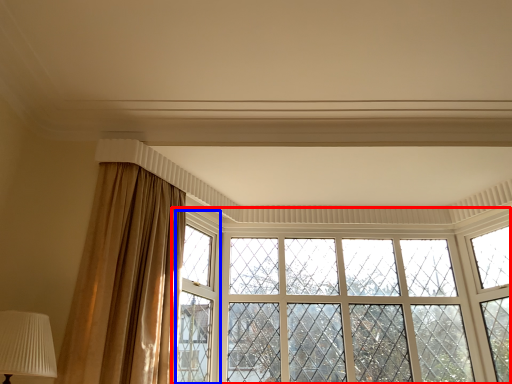
Question: Which object appears farthest to the camera in this image, window (highlighted by a red box) or window frame (highlighted by a blue box)?

Choices:
 (A) window
 (B) window frame

Answer: (A)